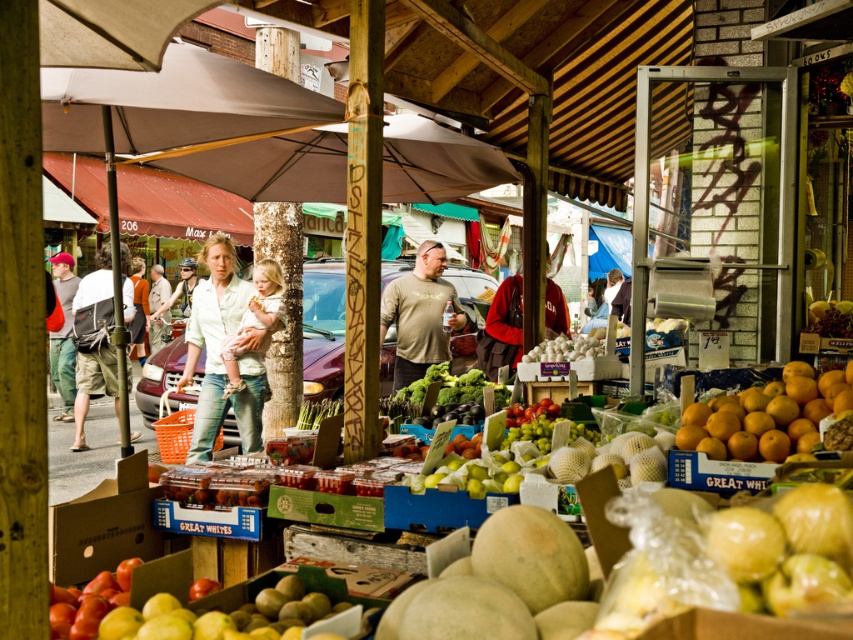
You are a photographer trying to capture a shot of the green leafy vegetables at center without the matte khaki shirt at center blocking the view. Can you adjust your angle to do this?

The matte khaki shirt at center is located above the green leafy vegetables at center, so if you lower your camera angle slightly, you can position it below the shirt to capture the vegetables without obstruction.

You are standing at the market entrance and want to reach the two points in the image. The first point is at coordinates point (640, 582) and the second is at point (830, 397). Which point should you reach first if you want to visit them in order from closest to farthest?

You should reach point (640, 582) first because it is closer to the viewer than point (830, 397).